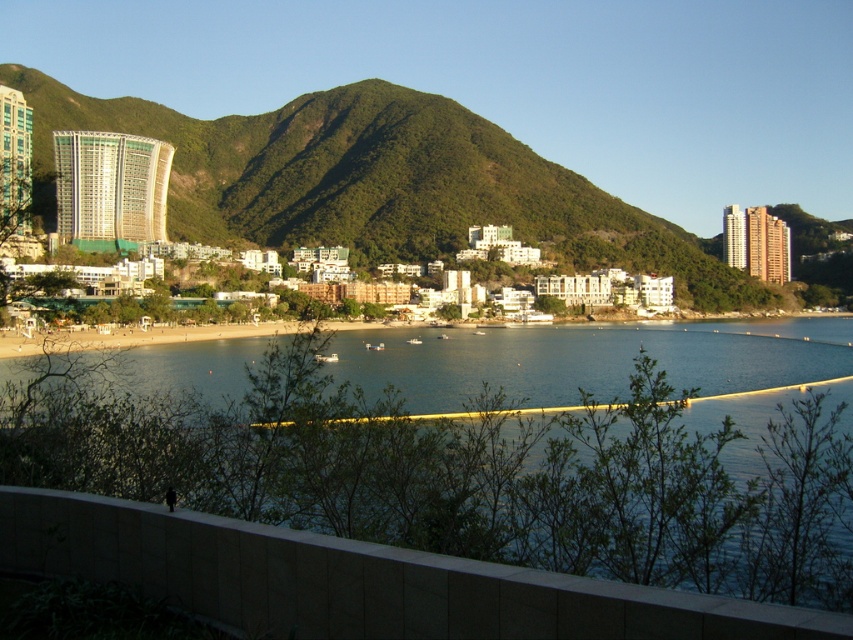
You are a photographer planning to capture a landscape shot of the clear blue water at center and the green textured mountain at center. Given their sizes, which object should you focus on to ensure it occupies a larger portion of your photo?

The green textured mountain at center is larger than the clear blue water at center, so focusing on it will ensure it occupies a larger portion of the photo.

You are standing at the concrete wall in the scenic coastal view. You see the clear blue water at center and the green textured mountain at center. Which one is nearer to you?

The clear blue water at center is closer to the viewer than the green textured mountain at center.

You are a photographer planning to capture the scenic coastal view. You want to ensure that both the clear blue water at center and the green textured mountain at center are visible in your shot. Based on their positions, which object should you frame first to include both in the composition?

The clear blue water at center is positioned on the right side of the green textured mountain at center. To include both in the composition, you should frame the green textured mountain at center first as it is on the left, allowing the clear blue water at center to naturally fall into the right side of the frame.